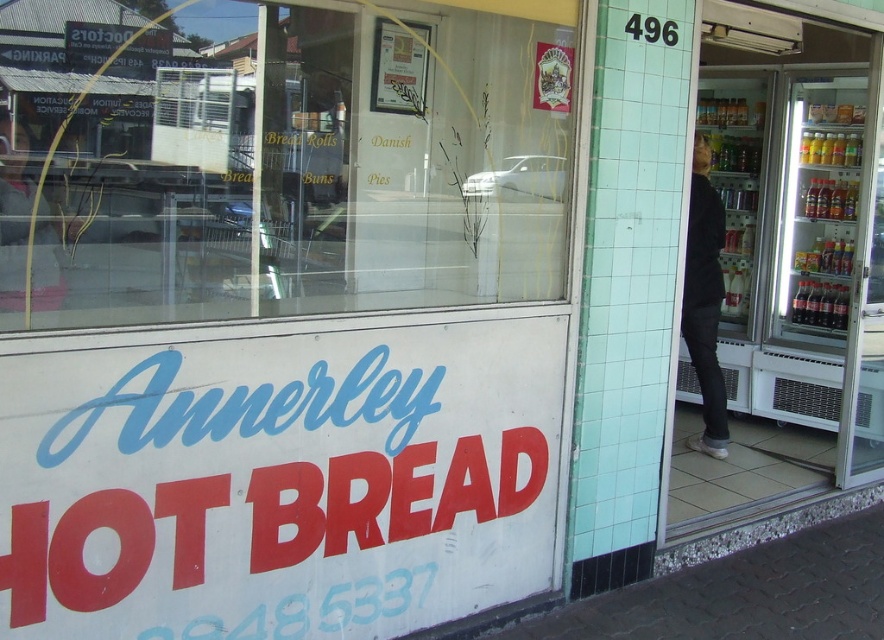
Consider the image. You are a delivery person approaching the bakery and want to enter. The transparent glass at center and the transparent glass door at right are in your path. Which one should you use to enter the store?

The transparent glass door at right should be used to enter the store because it occupies more space than the transparent glass at center, indicating it is the entrance.

You are a delivery person approaching the Annerley Hot Bread store. You see the transparent glass door at right and the black matte jacket at right. Which object is higher up in the image?

The transparent glass door at right is above the black matte jacket at right, so the transparent glass door at right is higher up in the image.